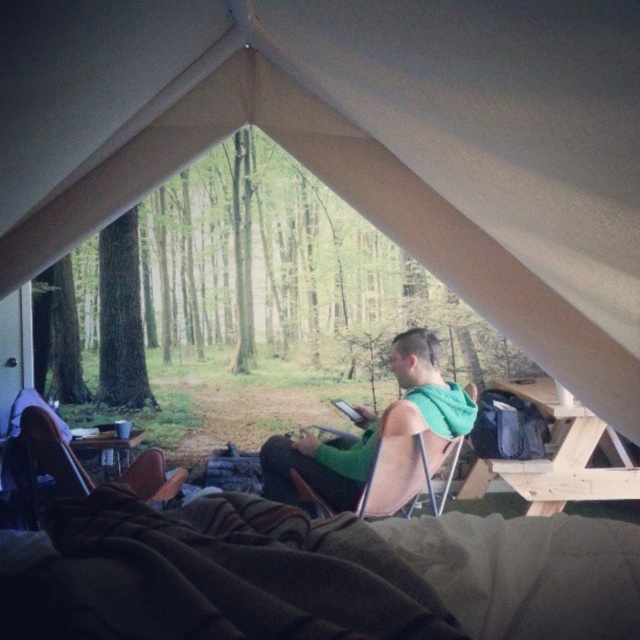
Find the location of a particular element. The width and height of the screenshot is (640, 640). brown leather chair at lower left is located at coordinates (49, 460).

Can you confirm if brown leather chair at lower left is positioned above wooden picnic table at center?

Actually, brown leather chair at lower left is below wooden picnic table at center.

Does point (68, 484) come behind point (134, 432)?

No.

What are the coordinates of `brown leather chair at lower left` in the screenshot? It's located at (49, 460).

Identify the location of green hoodie at center. The width and height of the screenshot is (640, 640). (321, 465).

Which is in front, point (451, 433) or point (128, 444)?

Point (451, 433) is in front.

Is point (336, 445) closer to viewer compared to point (113, 467)?

Yes.

Where is `green hoodie at center`? This screenshot has height=640, width=640. green hoodie at center is located at coordinates (321, 465).

Who is more distant from viewer, (570, 470) or (93, 444)?

Positioned behind is point (570, 470).

What are the coordinates of `wooden picnic table at lower right` in the screenshot? It's located at (564, 454).

You are a GUI agent. You are given a task and a screenshot of the screen. Output one action in this format:
    pyautogui.click(x=<x>, y=<y>)
    Task: Click on the wooden picnic table at lower right
    Image resolution: width=640 pixels, height=640 pixels.
    Given the screenshot: What is the action you would take?
    pyautogui.click(x=564, y=454)